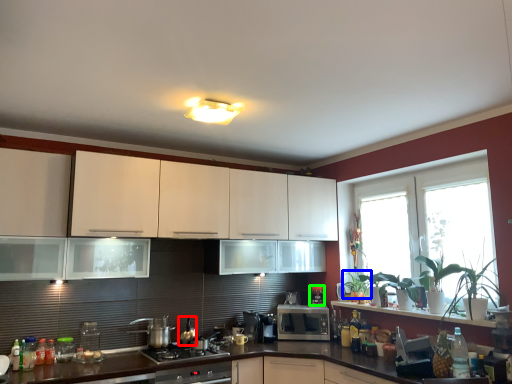
Question: Which is nearer to the appliance (highlighted by a red box)? plant (highlighted by a blue box) or coffee machine (highlighted by a green box).

Choices:
 (A) plant
 (B) coffee machine

Answer: (B)